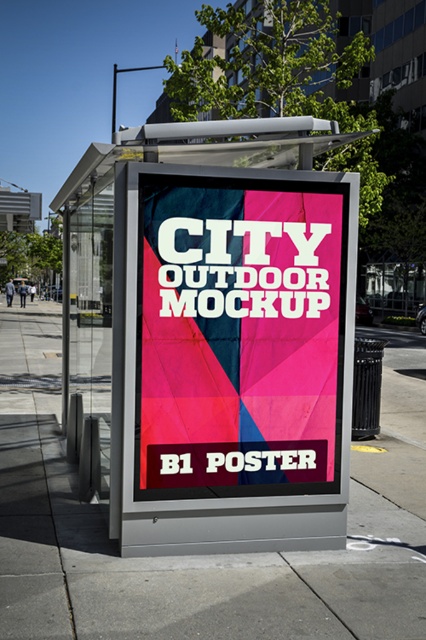
You are a city planner checking the placement of the matte pink poster at center and the matte gray pavement at center. Which object is covering the other?

The matte pink poster at center is positioned over matte gray pavement at center, so the poster is covering the pavement.

You are standing in front of the B1 poster on the sidewalk. There are two points marked on the poster. The first point is at coordinates point (305, 148) and the second point is at point (235, 625). Which point is closer to you?

Point (305, 148) is closer to you because it is further to the viewer than point (235, 625).